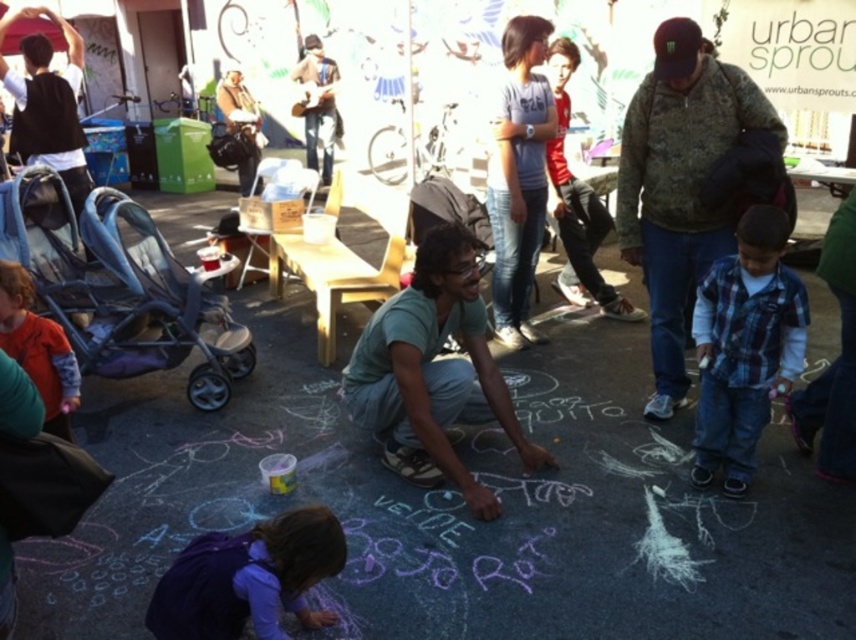
Can you confirm if green matte shirt at center is smaller than purple fleece jacket at lower center?

Incorrect, green matte shirt at center is not smaller in size than purple fleece jacket at lower center.

Image resolution: width=856 pixels, height=640 pixels. What do you see at coordinates (432, 372) in the screenshot? I see `green matte shirt at center` at bounding box center [432, 372].

The image size is (856, 640). What are the coordinates of `green matte shirt at center` in the screenshot? It's located at click(432, 372).

This screenshot has height=640, width=856. Identify the location of green matte shirt at center. (432, 372).

Who is positioned more to the right, plaid flannel shirt at center or orange fleece jacket at left?

plaid flannel shirt at center is more to the right.

Is plaid flannel shirt at center to the right of orange fleece jacket at left from the viewer's perspective?

Yes, plaid flannel shirt at center is to the right of orange fleece jacket at left.

I want to click on plaid flannel shirt at center, so click(577, 204).

This screenshot has height=640, width=856. Describe the element at coordinates (681, 186) in the screenshot. I see `camouflage jacket at upper right` at that location.

Who is more distant from viewer, (730, 228) or (557, 112)?

Point (557, 112)

Based on the photo, who is more forward, (698,161) or (553,179)?

Point (698,161)

In order to click on camouflage jacket at upper right in this screenshot , I will do `click(681, 186)`.